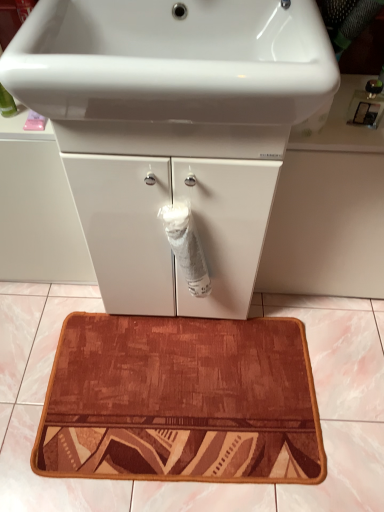
Question: Does white glossy cabinet at center turn towards white glossy sink at upper center?

Choices:
 (A) no
 (B) yes

Answer: (A)

Question: Is the position of white glossy cabinet at center more distant than that of white glossy sink at upper center?

Choices:
 (A) yes
 (B) no

Answer: (A)

Question: Is white glossy cabinet at center bigger than white glossy sink at upper center?

Choices:
 (A) yes
 (B) no

Answer: (A)

Question: Could white glossy sink at upper center be considered to be inside white glossy cabinet at center?

Choices:
 (A) no
 (B) yes

Answer: (A)

Question: From the image's perspective, would you say white glossy cabinet at center is shown under white glossy sink at upper center?

Choices:
 (A) no
 (B) yes

Answer: (B)

Question: In terms of size, does white glossy cabinet at center appear bigger or smaller than white matte toilet paper at center?

Choices:
 (A) small
 (B) big

Answer: (B)

Question: Would you say white glossy cabinet at center is inside or outside white matte toilet paper at center?

Choices:
 (A) inside
 (B) outside

Answer: (B)

Question: Considering their positions, is white glossy cabinet at center located in front of or behind white matte toilet paper at center?

Choices:
 (A) front
 (B) behind

Answer: (A)

Question: Is point (172, 173) closer or farther from the camera than point (188, 254)?

Choices:
 (A) farther
 (B) closer

Answer: (B)

Question: From the image's perspective, is white glossy cabinet at center above or below white glossy sink at upper center?

Choices:
 (A) below
 (B) above

Answer: (A)

Question: Is white glossy cabinet at center situated inside white glossy sink at upper center or outside?

Choices:
 (A) outside
 (B) inside

Answer: (A)

Question: From their relative heights in the image, would you say white glossy cabinet at center is taller or shorter than white glossy sink at upper center?

Choices:
 (A) tall
 (B) short

Answer: (A)

Question: Considering their positions, is white glossy cabinet at center located in front of or behind white glossy sink at upper center?

Choices:
 (A) front
 (B) behind

Answer: (B)

Question: Considering the positions of point (165, 377) and point (173, 230), is point (165, 377) closer or farther from the camera than point (173, 230)?

Choices:
 (A) closer
 (B) farther

Answer: (B)

Question: Considering the relative positions of brown textured bath mat at center and white matte toilet paper at center in the image provided, is brown textured bath mat at center to the left or to the right of white matte toilet paper at center?

Choices:
 (A) right
 (B) left

Answer: (B)